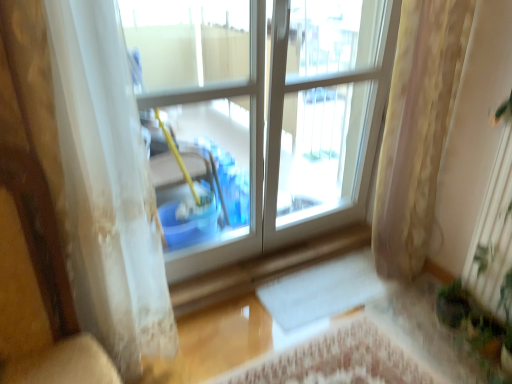
Question: Relative to green leafy plant at lower right, is wooden armchair at left in front or behind?

Choices:
 (A) front
 (B) behind

Answer: (A)

Question: Is wooden armchair at left taller or shorter than green leafy plant at lower right?

Choices:
 (A) tall
 (B) short

Answer: (A)

Question: Based on their relative distances, which object is farther from the yellow floral fabric curtain at right, which is the 2th curtain from left to right?

Choices:
 (A) wooden armchair at left
 (B) green leafy plant at lower right
 (C) white sheer curtain at left, which is counted as the 1th curtain, starting from the left
 (D) transparent plastic bucket at center

Answer: (A)

Question: Estimate the real-world distances between objects in this image. Which object is farther from the yellow floral fabric curtain at right, which is the 2th curtain from left to right?

Choices:
 (A) green leafy plant at lower right
 (B) transparent plastic bucket at center
 (C) white sheer curtain at left, which is the second curtain in right-to-left order
 (D) wooden armchair at left

Answer: (D)